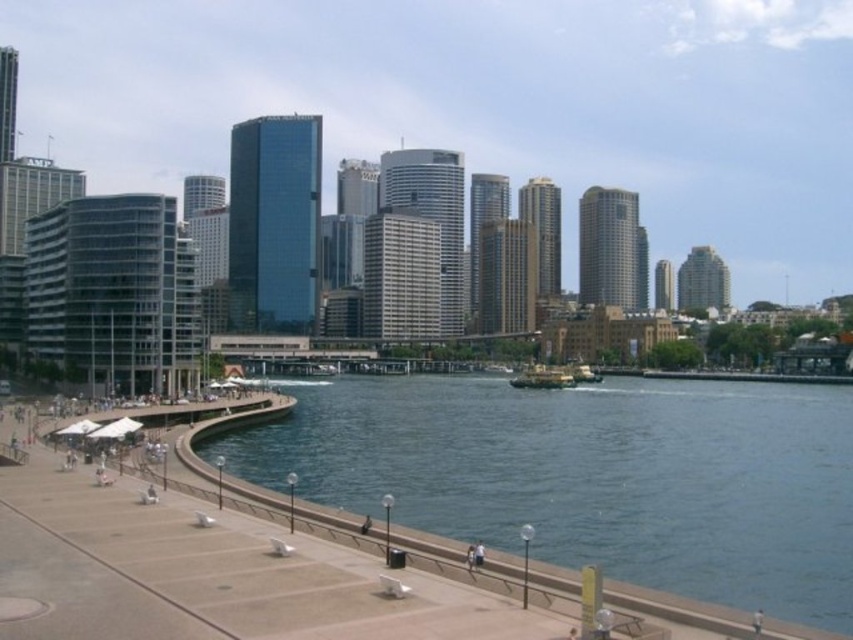
Question: Among these objects, which one is farthest from the camera?

Choices:
 (A) metallic gray boat at center
 (B) greenish-blue water at lower left

Answer: (A)

Question: Does greenish-blue water at lower left have a greater width compared to metallic gray boat at center?

Choices:
 (A) no
 (B) yes

Answer: (B)

Question: Is greenish-blue water at lower left further to camera compared to metallic gray boat at center?

Choices:
 (A) yes
 (B) no

Answer: (B)

Question: Which object is farther from the camera taking this photo?

Choices:
 (A) greenish-blue water at lower left
 (B) metallic gray boat at center

Answer: (B)

Question: Which point is closer to the camera?

Choices:
 (A) 527,384
 (B) 842,464

Answer: (B)

Question: Does greenish-blue water at lower left have a greater width compared to metallic gray boat at center?

Choices:
 (A) no
 (B) yes

Answer: (B)